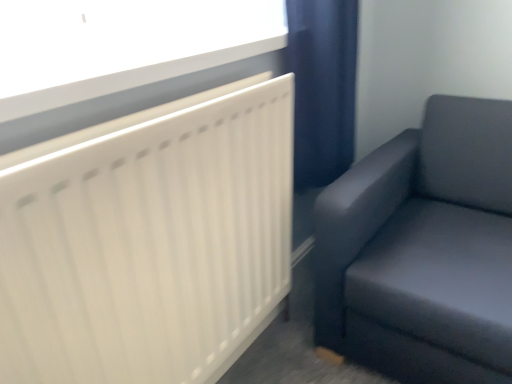
What is the approximate height of white matte radiator at upper left?

It is 34.19 inches.

What is the approximate width of white plastic window sill at upper left?

white plastic window sill at upper left is 10.39 inches wide.

Locate an element on the screen. This screenshot has height=384, width=512. matte gray couch at right is located at coordinates (423, 250).

Who is shorter, matte gray couch at right or white plastic window sill at upper left?

white plastic window sill at upper left is shorter.

Is matte gray couch at right aimed at white plastic window sill at upper left?

No.

Looking at this image, how different are the orientations of matte gray couch at right and white plastic window sill at upper left in degrees?

They differ by 88.6 degrees in their facing directions.

Find the location of `studio couch located below the white plastic window sill at upper left (from the image's perspective)`. studio couch located below the white plastic window sill at upper left (from the image's perspective) is located at coordinates (423, 250).

Can you tell me how much matte gray couch at right and white matte radiator at upper left differ in facing direction?

88.6 degrees.

From the picture: Could you tell me if matte gray couch at right is facing white matte radiator at upper left?

No, matte gray couch at right is not oriented towards white matte radiator at upper left.

From the image's perspective, is matte gray couch at right above or below white matte radiator at upper left?

From the image's perspective, matte gray couch at right appears above white matte radiator at upper left.

Considering the relative sizes of white matte radiator at upper left and white plastic window sill at upper left in the image provided, is white matte radiator at upper left wider than white plastic window sill at upper left?

Incorrect, the width of white matte radiator at upper left does not surpass that of white plastic window sill at upper left.

Is white matte radiator at upper left not inside white plastic window sill at upper left?

white matte radiator at upper left lies outside white plastic window sill at upper left's area.

Which is more to the right, white matte radiator at upper left or white plastic window sill at upper left?

white matte radiator at upper left.

How far apart are white matte radiator at upper left and white plastic window sill at upper left?

A distance of 25.03 centimeters exists between white matte radiator at upper left and white plastic window sill at upper left.

Considering the positions of objects white plastic window sill at upper left and matte gray couch at right in the image provided, who is more to the right, white plastic window sill at upper left or matte gray couch at right?

Positioned to the right is matte gray couch at right.

How many degrees apart are the facing directions of white plastic window sill at upper left and matte gray couch at right?

There is a 88.6-degree angle between the facing directions of white plastic window sill at upper left and matte gray couch at right.

Does white plastic window sill at upper left touch matte gray couch at right?

white plastic window sill at upper left and matte gray couch at right are not in contact.

Which of these two, white plastic window sill at upper left or matte gray couch at right, is bigger?

Bigger between the two is matte gray couch at right.

Between white matte radiator at upper left and matte gray couch at right, which one has larger width?

Wider between the two is matte gray couch at right.

Are white matte radiator at upper left and matte gray couch at right far apart?

Actually, white matte radiator at upper left and matte gray couch at right are a little close together.

Which of these two, white matte radiator at upper left or matte gray couch at right, is smaller?

white matte radiator at upper left.

Which of these two, white plastic window sill at upper left or white matte radiator at upper left, is bigger?

white matte radiator at upper left is bigger.

Is white plastic window sill at upper left inside the boundaries of white matte radiator at upper left, or outside?

white plastic window sill at upper left is located beyond the bounds of white matte radiator at upper left.

Find the location of a particular element. radiator lying below the white plastic window sill at upper left (from the image's perspective) is located at coordinates (148, 241).

How different are the orientations of white plastic window sill at upper left and white matte radiator at upper left in degrees?

The angular difference between white plastic window sill at upper left and white matte radiator at upper left is 0.00516 degrees.

Locate an element on the screen. The height and width of the screenshot is (384, 512). window sill above the matte gray couch at right (from the image's perspective) is located at coordinates (137, 98).

This screenshot has height=384, width=512. What are the coordinates of `radiator on the left of matte gray couch at right` in the screenshot? It's located at (148, 241).

Looking at the image, which one is located further to white plastic window sill at upper left, matte gray couch at right or white matte radiator at upper left?

matte gray couch at right.

Estimate the real-world distances between objects in this image. Which object is further from white matte radiator at upper left, matte gray couch at right or white plastic window sill at upper left?

The object further to white matte radiator at upper left is matte gray couch at right.

Looking at the image, which one is located closer to matte gray couch at right, white plastic window sill at upper left or white matte radiator at upper left?

Among the two, white matte radiator at upper left is located nearer to matte gray couch at right.

Consider the image. Considering their positions, is white plastic window sill at upper left positioned further to white matte radiator at upper left than matte gray couch at right?

The object further to white matte radiator at upper left is matte gray couch at right.

Based on their spatial positions, is white matte radiator at upper left or matte gray couch at right closer to white plastic window sill at upper left?

white matte radiator at upper left is positioned closer to the anchor white plastic window sill at upper left.

When comparing their distances from matte gray couch at right, does white matte radiator at upper left or white plastic window sill at upper left seem closer?

white matte radiator at upper left.

Identify the location of radiator between white plastic window sill at upper left and matte gray couch at right in the horizontal direction. The width and height of the screenshot is (512, 384). (148, 241).